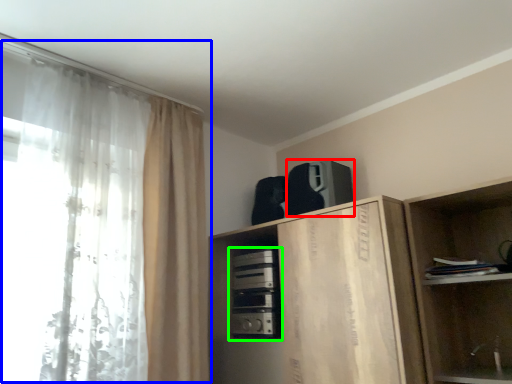
Question: Which object is positioned closest to appliance (highlighted by a red box)? Select from curtain (highlighted by a blue box) and appliance (highlighted by a green box).

Choices:
 (A) curtain
 (B) appliance

Answer: (B)